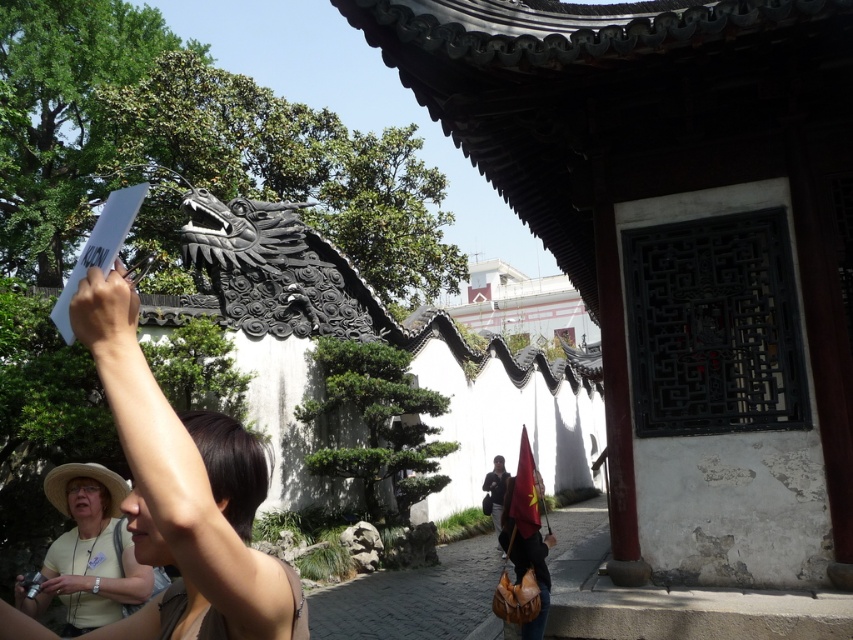
Question: Is yellow fabric at center to the left of dark blue fabric bag at lower center from the viewer's perspective?

Choices:
 (A) yes
 (B) no

Answer: (A)

Question: Estimate the real-world distances between objects in this image. Which object is closer to the matte black hair at upper left?

Choices:
 (A) dark blue fabric bag at lower center
 (B) yellow fabric at center

Answer: (B)

Question: Can you confirm if yellow fabric at center is wider than dark blue fabric bag at lower center?

Choices:
 (A) yes
 (B) no

Answer: (A)

Question: Which of the following is the closest to the observer?

Choices:
 (A) (84, 611)
 (B) (492, 484)
 (C) (195, 580)

Answer: (C)

Question: Which of the following is the farthest from the observer?

Choices:
 (A) (497, 500)
 (B) (131, 600)

Answer: (A)

Question: Does matte black hair at upper left appear on the right side of dark blue fabric bag at lower center?

Choices:
 (A) yes
 (B) no

Answer: (B)